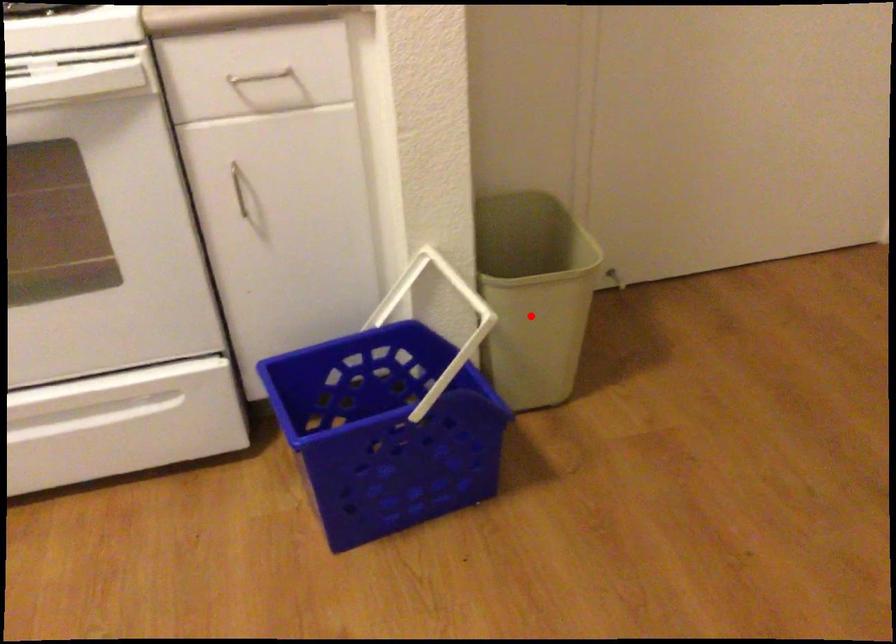
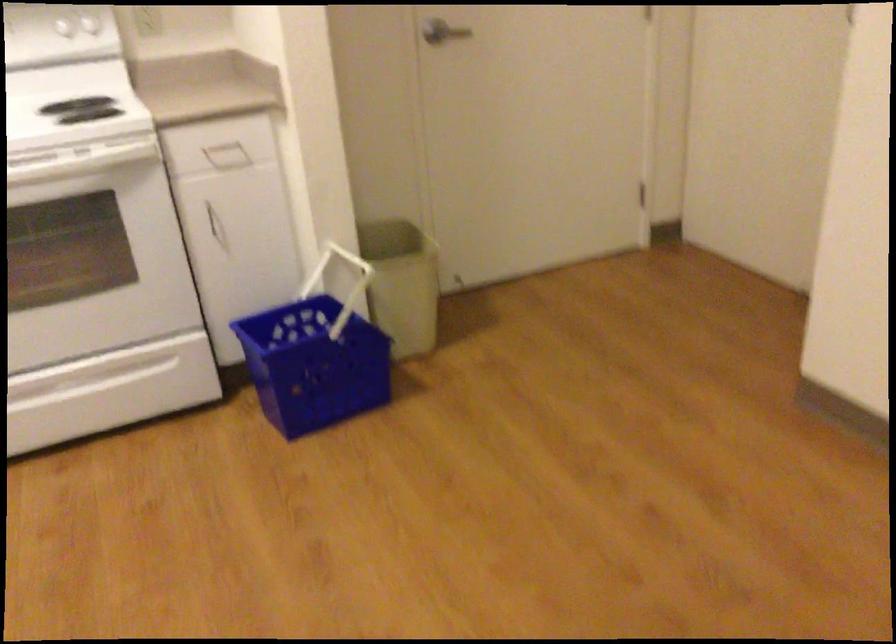
Question: A red point is marked in image1. In image2, is the corresponding 3D point closer to the camera or farther? Reply with the corresponding letter.

Choices:
 (A) The corresponding 3D point is closer.
 (B) The corresponding 3D point is farther.

Answer: (B)